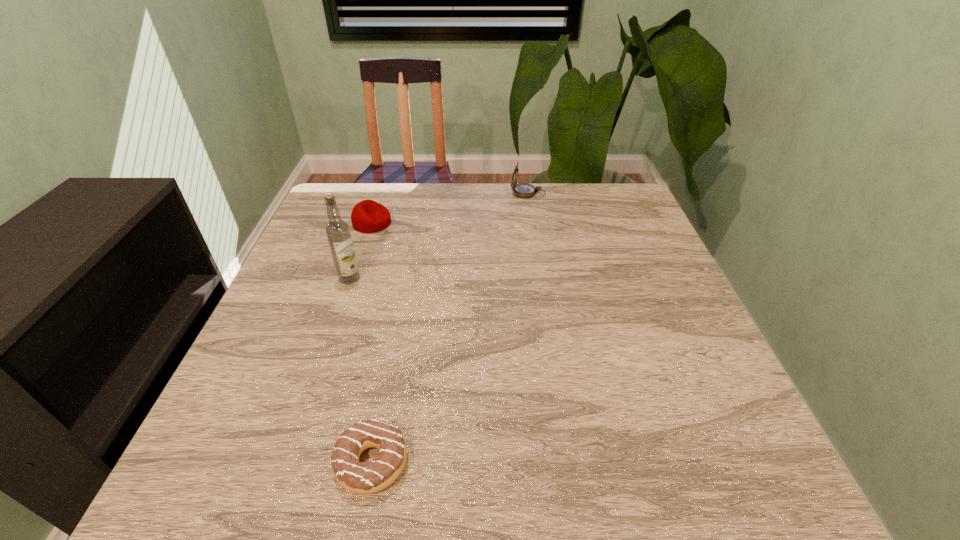
Locate an element on the screen. vacant space that satisfies the following two spatial constraints: 1. on the seat area of the beanbag; 2. on the label of the second nearest object is located at coordinates (x=353, y=279).

Find the location of a particular element. free space that satisfies the following two spatial constraints: 1. on the seat area of the second farthest object; 2. on the label of the tallest object is located at coordinates (353, 279).

The height and width of the screenshot is (540, 960). I want to click on vacant space that satisfies the following two spatial constraints: 1. on the label of the vodka; 2. on the left side of the shortest object, so click(287, 462).

Image resolution: width=960 pixels, height=540 pixels. Identify the location of free space that satisfies the following two spatial constraints: 1. on the label of the vodka; 2. on the left side of the nearest object. (287, 462).

Locate an element on the screen. The image size is (960, 540). free space that satisfies the following two spatial constraints: 1. on the seat area of the third nearest object; 2. on the label of the third farthest object is located at coordinates (353, 279).

Locate an element on the screen. The height and width of the screenshot is (540, 960). free point that satisfies the following two spatial constraints: 1. on the face of the rightmost object; 2. on the label of the vodka is located at coordinates (542, 279).

Find the location of `vacant area in the image that satisfies the following two spatial constraints: 1. on the label of the second object from right to left; 2. on the left side of the vodka`. vacant area in the image that satisfies the following two spatial constraints: 1. on the label of the second object from right to left; 2. on the left side of the vodka is located at coordinates (287, 462).

Locate an element on the screen. The width and height of the screenshot is (960, 540). free space that satisfies the following two spatial constraints: 1. on the face of the rightmost object; 2. on the label of the tallest object is located at coordinates pyautogui.click(x=542, y=279).

Identify the location of blank space that satisfies the following two spatial constraints: 1. on the seat area of the beanbag; 2. on the label of the vodka. This screenshot has width=960, height=540. (353, 279).